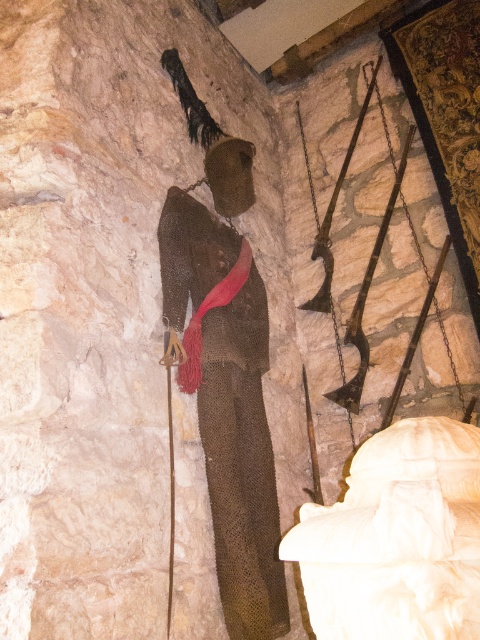
Does gold chainmail suit at center come behind wooden ski pole at center?

Yes, gold chainmail suit at center is further from the viewer.

Is gold chainmail suit at center below wooden ski pole at center?

No, gold chainmail suit at center is not below wooden ski pole at center.

Is point (178, 369) closer to camera compared to point (169, 490)?

No, it is not.

Where is `gold chainmail suit at center`? Image resolution: width=480 pixels, height=640 pixels. gold chainmail suit at center is located at coordinates (228, 404).